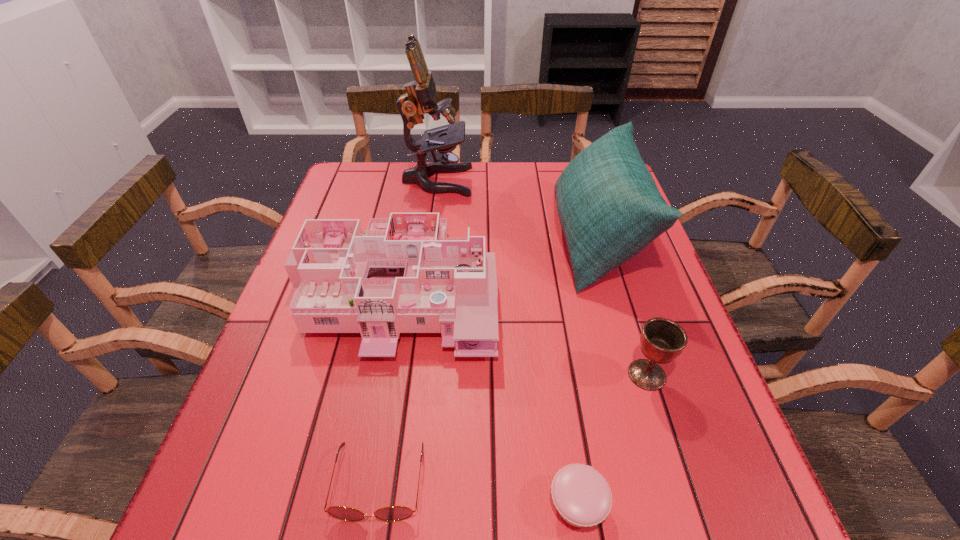
Find the location of a particular element. The image size is (960, 540). object present at the far right corner is located at coordinates (609, 206).

Locate an element on the screen. This screenshot has width=960, height=540. free spot at the far edge of the desktop is located at coordinates (507, 200).

The width and height of the screenshot is (960, 540). In order to click on vacant space at the near edge in this screenshot , I will do `click(435, 519)`.

Where is `vacant space at the left edge`? This screenshot has height=540, width=960. vacant space at the left edge is located at coordinates (281, 380).

Where is `free location at the right edge of the desktop`? free location at the right edge of the desktop is located at coordinates (664, 429).

Locate an element on the screen. Image resolution: width=960 pixels, height=540 pixels. free location at the far left corner is located at coordinates (376, 186).

The width and height of the screenshot is (960, 540). I want to click on free space at the near right corner of the desktop, so click(745, 515).

Where is `vacant area that lies between the cupcake and the cushion`? This screenshot has width=960, height=540. vacant area that lies between the cupcake and the cushion is located at coordinates (587, 372).

At what (x,y) coordinates should I click in order to perform the action: click on empty space that is in between the sunglasses and the dollhouse. Please return your answer as a coordinate pair (x, y). Looking at the image, I should click on (387, 386).

This screenshot has width=960, height=540. In order to click on empty space that is in between the cupcake and the dollhouse in this screenshot , I will do `click(487, 396)`.